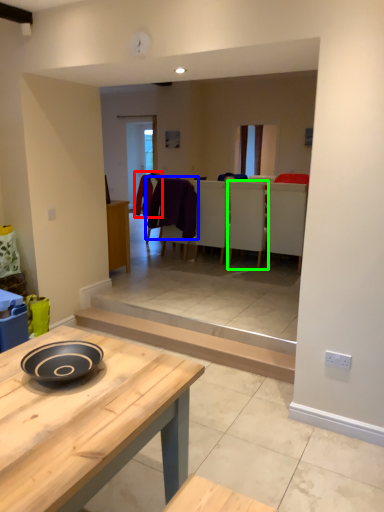
Question: Considering the real-world distances, which object is closest to laundry (highlighted by a red box)? laundry (highlighted by a blue box) or chair (highlighted by a green box).

Choices:
 (A) laundry
 (B) chair

Answer: (A)